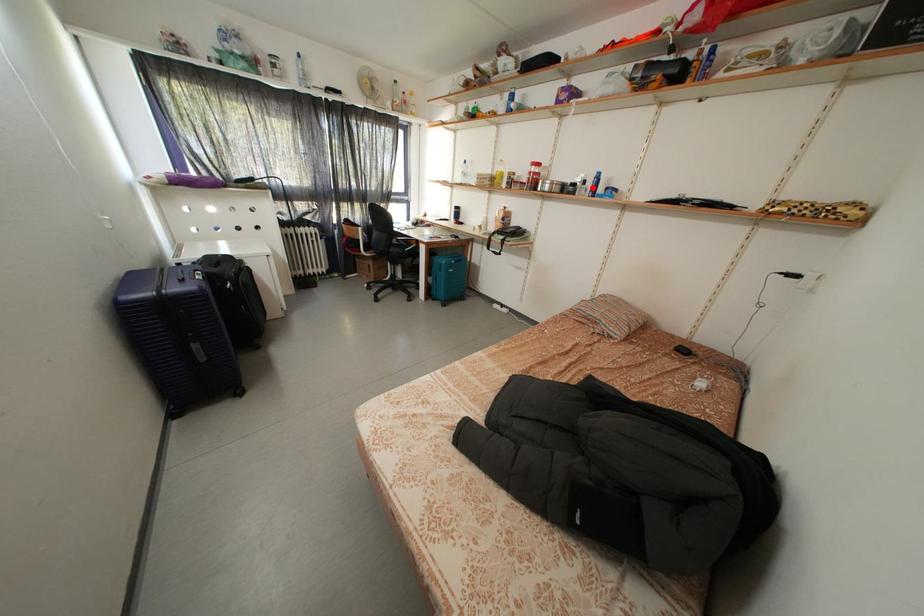
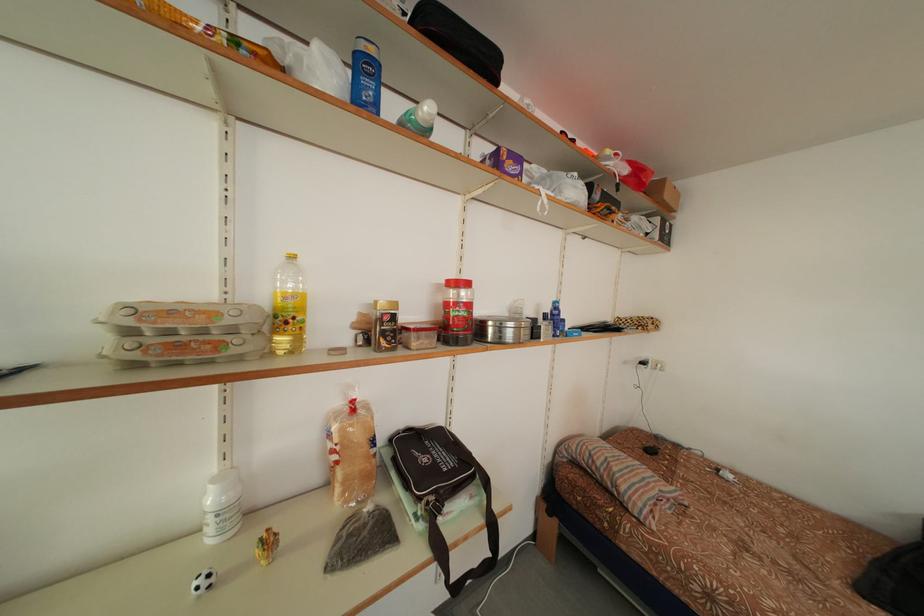
In the second image, find the point that corresponds to the highlighted location in the first image.

(553, 322)